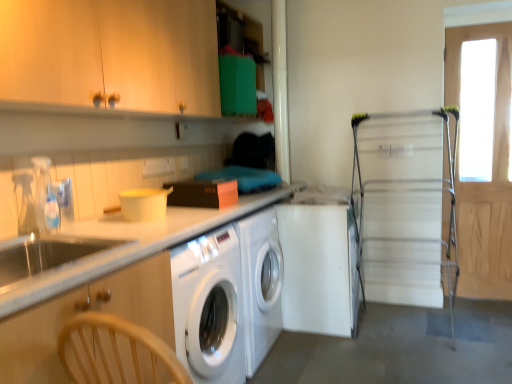
Question: Is wooden screen door at right, placed as the second screen door when sorted from left to right, not inside wooden cabinet at upper left, which is the first cabinetry from top to bottom?

Choices:
 (A) yes
 (B) no

Answer: (A)

Question: Is wooden screen door at right, placed as the second screen door when sorted from left to right, thinner than wooden cabinet at upper left, which is the first cabinetry from top to bottom?

Choices:
 (A) yes
 (B) no

Answer: (A)

Question: Is there a large distance between wooden screen door at right, placed as the second screen door when sorted from left to right, and wooden cabinet at upper left, which is the first cabinetry from top to bottom?

Choices:
 (A) yes
 (B) no

Answer: (A)

Question: Considering the relative sizes of wooden screen door at right, placed as the second screen door when sorted from left to right, and wooden cabinet at upper left, which is the first cabinetry from top to bottom, in the image provided, is wooden screen door at right, placed as the second screen door when sorted from left to right, shorter than wooden cabinet at upper left, which is the first cabinetry from top to bottom,?

Choices:
 (A) yes
 (B) no

Answer: (B)

Question: Is wooden screen door at right, placed as the second screen door when sorted from left to right, smaller than wooden cabinet at upper left, acting as the second cabinetry starting from the bottom?

Choices:
 (A) yes
 (B) no

Answer: (A)

Question: Is wooden screen door at right, which is the first screen door in right-to-left order, placed right next to wooden cabinet at upper left, which is the first cabinetry from top to bottom?

Choices:
 (A) yes
 (B) no

Answer: (B)

Question: Considering the relative sizes of metallic silver drying rack at right, which appears as the second screen door when viewed from the right, and wooden cabinet at left, which appears as the 1th cabinetry when ordered from the bottom, in the image provided, is metallic silver drying rack at right, which appears as the second screen door when viewed from the right, wider than wooden cabinet at left, which appears as the 1th cabinetry when ordered from the bottom,?

Choices:
 (A) no
 (B) yes

Answer: (A)

Question: Is metallic silver drying rack at right, placed as the 1th screen door when sorted from left to right, oriented away from wooden cabinet at left, marked as the second cabinetry in a top-to-bottom arrangement?

Choices:
 (A) no
 (B) yes

Answer: (A)

Question: Is metallic silver drying rack at right, placed as the 1th screen door when sorted from left to right, to the left of wooden cabinet at left, which appears as the 1th cabinetry when ordered from the bottom, from the viewer's perspective?

Choices:
 (A) no
 (B) yes

Answer: (A)

Question: From a real-world perspective, is metallic silver drying rack at right, which appears as the second screen door when viewed from the right, positioned under wooden cabinet at left, which appears as the 1th cabinetry when ordered from the bottom, based on gravity?

Choices:
 (A) yes
 (B) no

Answer: (B)

Question: Is the position of metallic silver drying rack at right, which appears as the second screen door when viewed from the right, more distant than that of wooden cabinet at left, which appears as the 1th cabinetry when ordered from the bottom?

Choices:
 (A) no
 (B) yes

Answer: (B)

Question: Considering the relative sizes of metallic silver drying rack at right, which appears as the second screen door when viewed from the right, and wooden cabinet at left, which appears as the 1th cabinetry when ordered from the bottom, in the image provided, is metallic silver drying rack at right, which appears as the second screen door when viewed from the right, shorter than wooden cabinet at left, which appears as the 1th cabinetry when ordered from the bottom,?

Choices:
 (A) no
 (B) yes

Answer: (A)

Question: Is clear plastic faucet at left further to camera compared to wooden cabinet at left, which appears as the 1th cabinetry when ordered from the bottom?

Choices:
 (A) yes
 (B) no

Answer: (A)